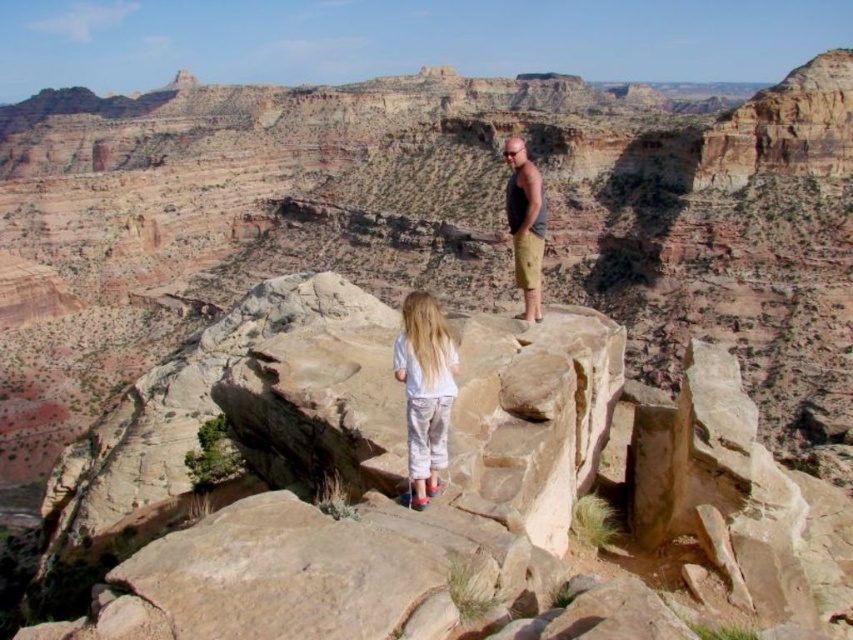
Question: Which point appears closest to the camera in this image?

Choices:
 (A) (515, 163)
 (B) (410, 406)

Answer: (B)

Question: Which of the following is the farthest from the observer?

Choices:
 (A) light blue cotton shirt at center
 (B) matte black tank top at center

Answer: (B)

Question: Can you confirm if light blue cotton shirt at center is smaller than matte black tank top at center?

Choices:
 (A) no
 (B) yes

Answer: (B)

Question: Can you confirm if light blue cotton shirt at center is thinner than matte black tank top at center?

Choices:
 (A) yes
 (B) no

Answer: (A)

Question: Does light blue cotton shirt at center appear over matte black tank top at center?

Choices:
 (A) yes
 (B) no

Answer: (B)

Question: Which object appears closest to the camera in this image?

Choices:
 (A) matte black tank top at center
 (B) light blue cotton shirt at center

Answer: (B)